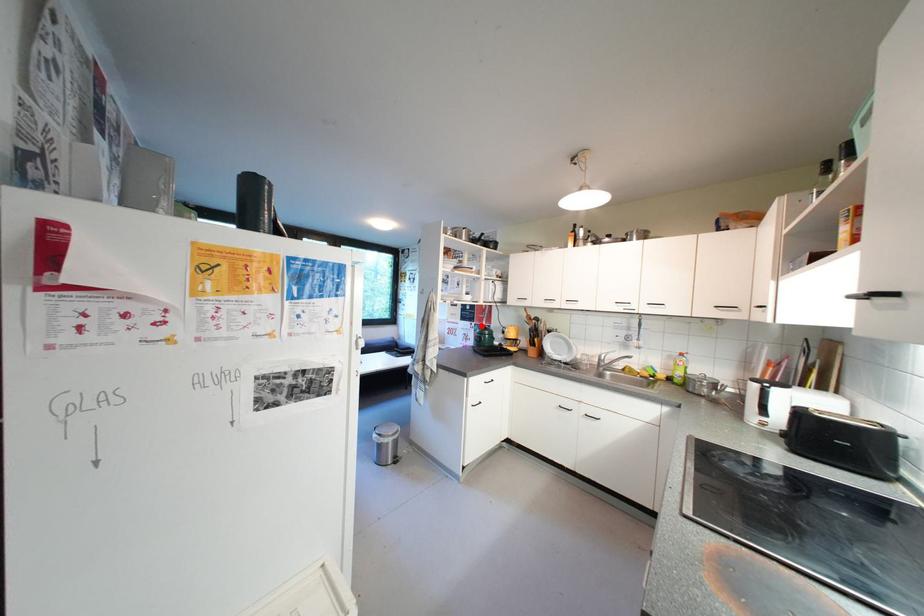
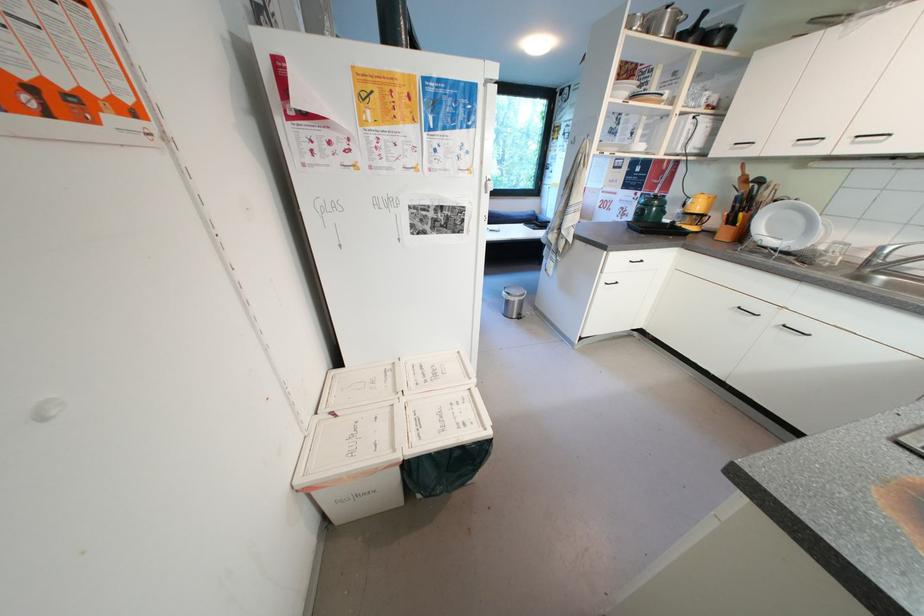
Question: A red point is marked in image1. In image2, is the corresponding 3D point closer to the camera or farther? Reply with the corresponding letter.

Choices:
 (A) The corresponding 3D point is closer.
 (B) The corresponding 3D point is farther.

Answer: (A)